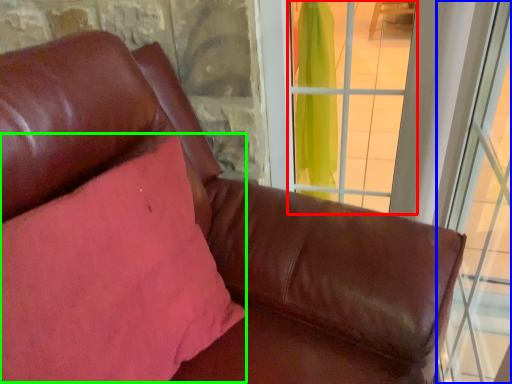
Question: Estimate the real-world distances between objects in this image. Which object is farther from window (highlighted by a red box), window (highlighted by a blue box) or pillow (highlighted by a green box)?

Choices:
 (A) window
 (B) pillow

Answer: (B)